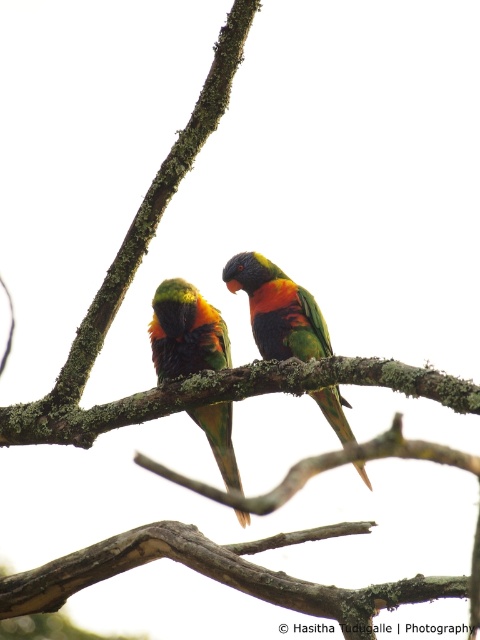
Question: Observing the image, what is the correct spatial positioning of multicolored feathered parrot at center in reference to rainbow feathered parrot at center?

Choices:
 (A) below
 (B) above

Answer: (A)

Question: Is multicolored feathered parrot at center smaller than rainbow feathered parrot at center?

Choices:
 (A) yes
 (B) no

Answer: (A)

Question: Which point appears farthest from the camera in this image?

Choices:
 (A) (292, 323)
 (B) (200, 330)

Answer: (A)

Question: Which of the following is the closest to the observer?

Choices:
 (A) multicolored feathered parrot at center
 (B) rainbow feathered parrot at center

Answer: (B)

Question: Is multicolored feathered parrot at center positioned at the back of rainbow feathered parrot at center?

Choices:
 (A) yes
 (B) no

Answer: (A)